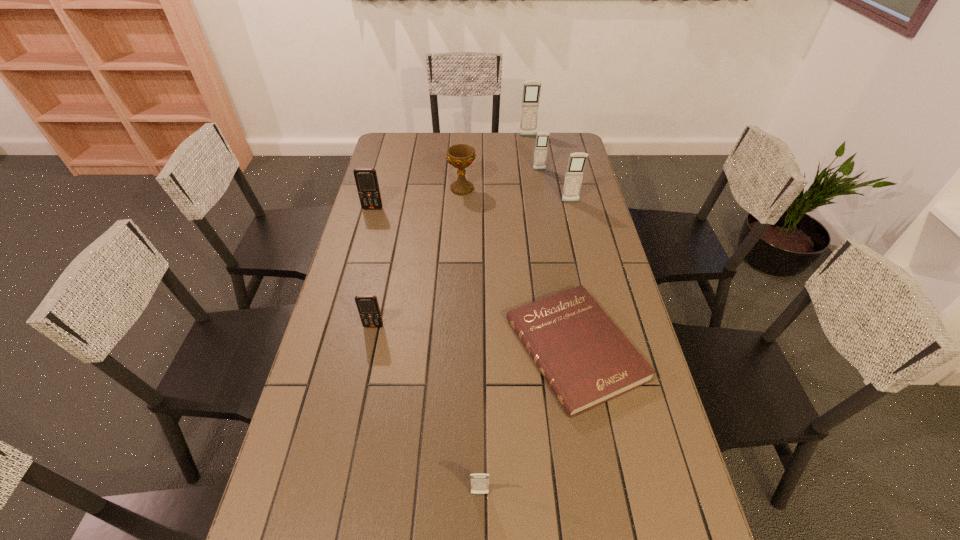
Where is `free region located on the screen of the seventh object from right to left`? Image resolution: width=960 pixels, height=540 pixels. free region located on the screen of the seventh object from right to left is located at coordinates (347, 453).

Where is `vacant space located 0.330m on the left of the shortest object`? vacant space located 0.330m on the left of the shortest object is located at coordinates (392, 349).

Image resolution: width=960 pixels, height=540 pixels. What are the coordinates of `object that is at the far edge` in the screenshot? It's located at (531, 89).

Find the location of a particular element. cellular telephone at the right edge is located at coordinates (577, 161).

You are a GUI agent. You are given a task and a screenshot of the screen. Output one action in this format:
    pyautogui.click(x=<x>, y=<y>)
    Task: Click on the hardback book located in the right edge section of the desktop
    The image size is (960, 540).
    Given the screenshot: What is the action you would take?
    pyautogui.click(x=585, y=358)

In the image, there is a desktop. What are the coordinates of `vacant space at the far edge` in the screenshot? It's located at (432, 156).

You are a GUI agent. You are given a task and a screenshot of the screen. Output one action in this format:
    pyautogui.click(x=<x>, y=<y>)
    Task: Click on the blank area at the left edge
    The height and width of the screenshot is (540, 960).
    Given the screenshot: What is the action you would take?
    pyautogui.click(x=386, y=191)

Locate an element on the screen. Image resolution: width=960 pixels, height=540 pixels. blank space at the right edge of the desktop is located at coordinates (681, 493).

Find the location of a particular element. This screenshot has width=960, height=540. empty location between the rightmost cellular telephone and the leftmost cellular telephone is located at coordinates (471, 205).

Locate an element on the screen. This screenshot has width=960, height=540. vacant area between the sixth nearest object and the second smallest gray cellular telephone is located at coordinates (501, 179).